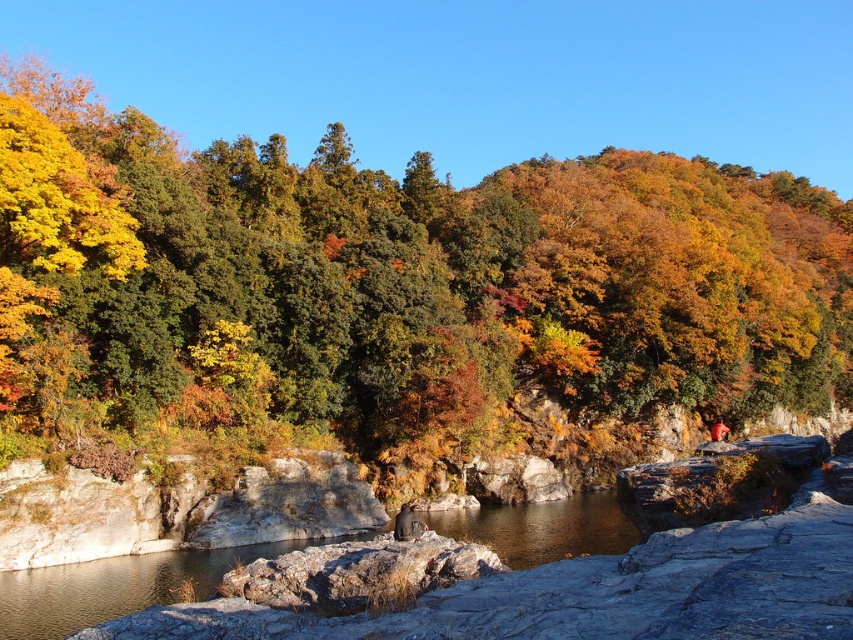
Question: In this image, where is yellow-green leaves at center located relative to dark gray fabric person at center?

Choices:
 (A) right
 (B) left

Answer: (A)

Question: Is rough gray rock at center wider than dark gray fabric person at center?

Choices:
 (A) yes
 (B) no

Answer: (A)

Question: Can you confirm if brown rock at center is smaller than dark gray fabric person at center?

Choices:
 (A) yes
 (B) no

Answer: (B)

Question: Which object appears closest to the camera in this image?

Choices:
 (A) dark gray fabric person at center
 (B) rough gray rock at center

Answer: (B)

Question: Estimate the real-world distances between objects in this image. Which object is farther from the dark gray fabric person at center?

Choices:
 (A) yellow-green leaves at center
 (B) rough gray rock at center
 (C) brown rock at center

Answer: (A)

Question: Which is farther from the rough gray rock at center?

Choices:
 (A) yellow-green leaves at center
 (B) dark gray fabric person at center

Answer: (A)